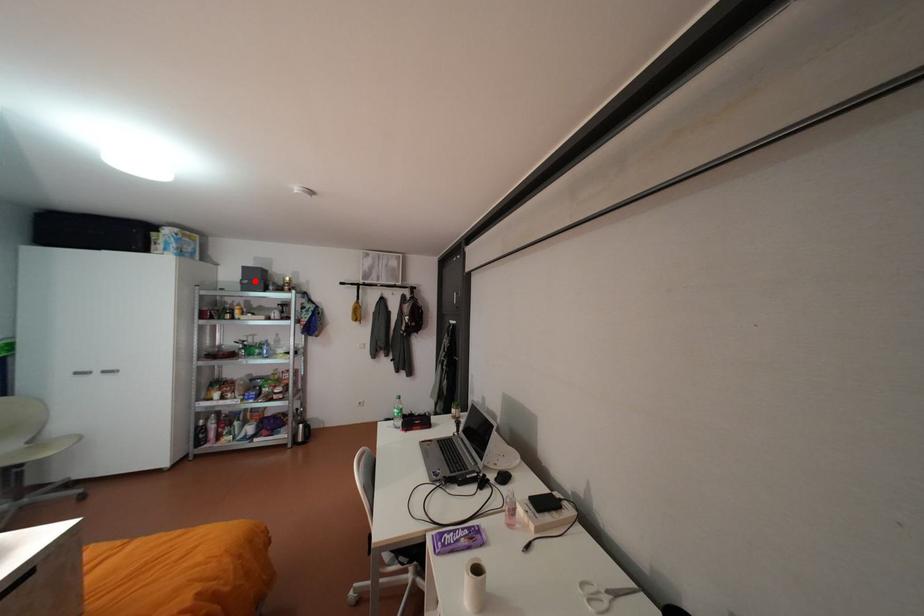
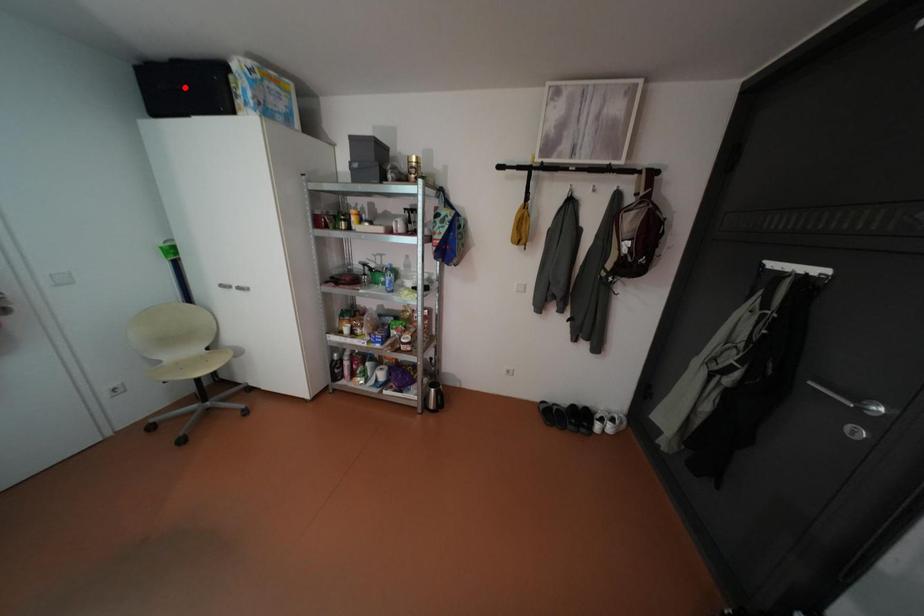
I am providing you with two images of the same scene from different viewpoints. A red point is marked on the first image and another point is marked on the second image. Is the red point in image1 aligned with the point shown in image2?

No